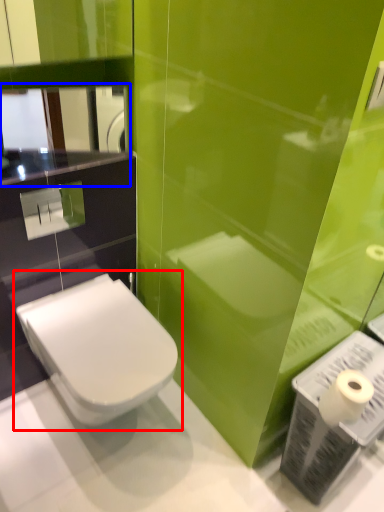
Question: Which of the following is the closest to the observer, toilet (highlighted by a red box) or mirror (highlighted by a blue box)?

Choices:
 (A) toilet
 (B) mirror

Answer: (A)